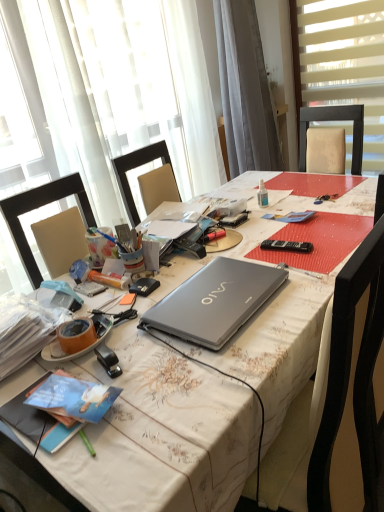
Where is `free space in front of blue paperback book at lower left, the 2th book positioned from the bottom`? free space in front of blue paperback book at lower left, the 2th book positioned from the bottom is located at coordinates (96, 463).